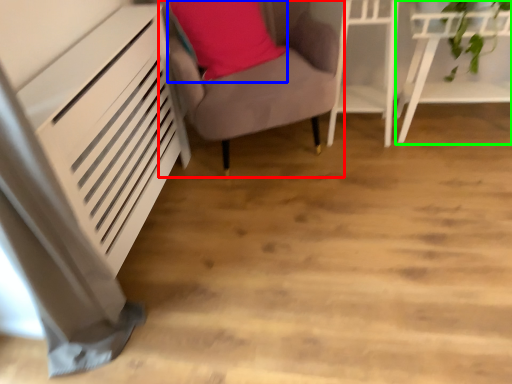
Question: Considering the real-world distances, which object is closest to furniture (highlighted by a red box)? pillow (highlighted by a blue box) or furniture (highlighted by a green box).

Choices:
 (A) pillow
 (B) furniture

Answer: (A)